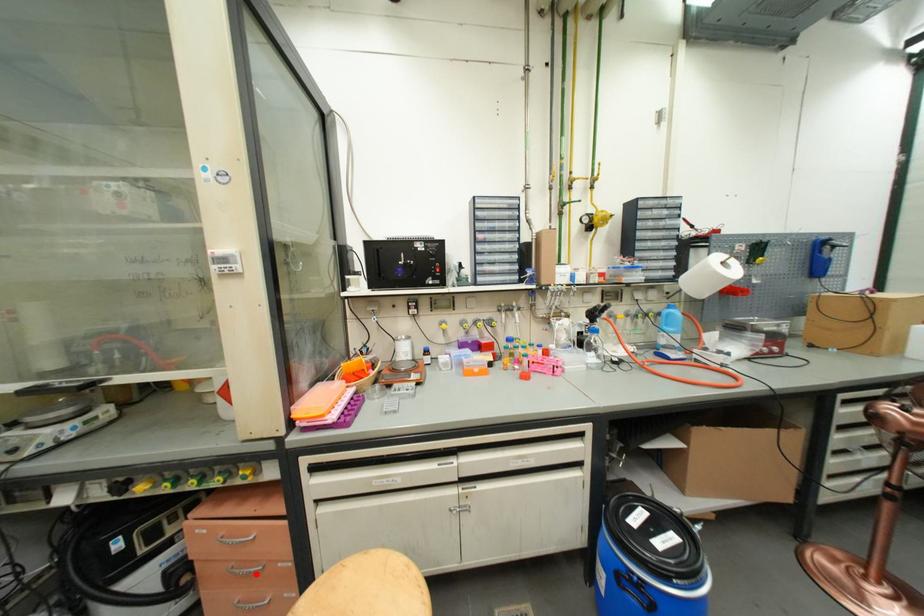
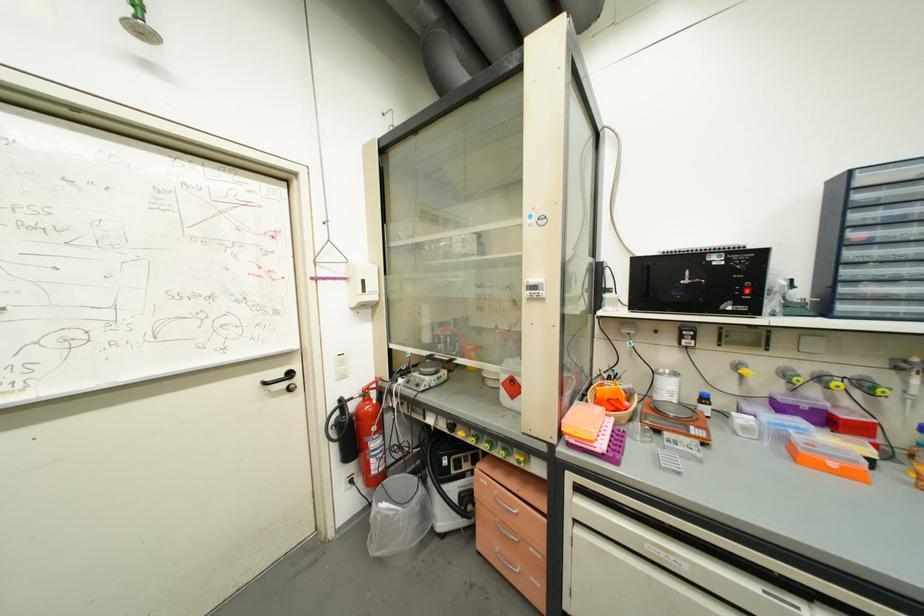
Locate, in the second image, the point that corresponds to the highlighted location in the first image.

(516, 540)